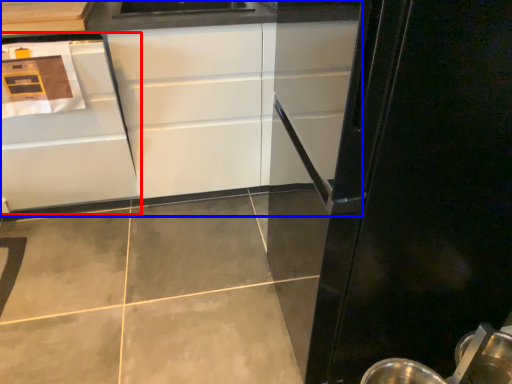
Question: Which of the following is the farthest to the observer, cabinetry (highlighted by a red box) or cabinetry (highlighted by a blue box)?

Choices:
 (A) cabinetry
 (B) cabinetry

Answer: (B)